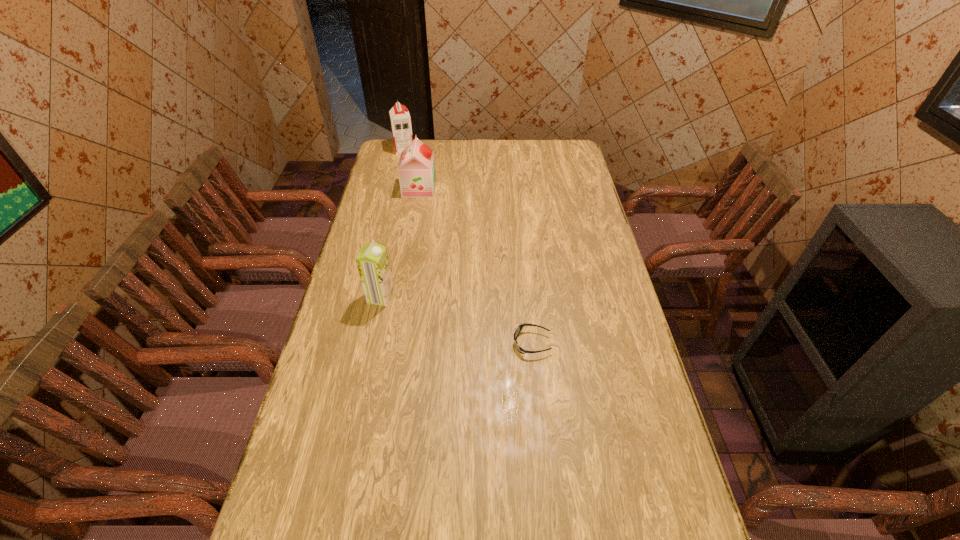
What are the coordinates of `blank space located on the lenses of the sunglasses` in the screenshot? It's located at (383, 343).

What are the coordinates of `object positioned at the far edge` in the screenshot? It's located at click(x=400, y=119).

The image size is (960, 540). I want to click on object situated at the far left corner, so click(400, 119).

I want to click on vacant area at the far edge, so click(x=470, y=160).

Where is `vacant space at the left edge of the desktop`? vacant space at the left edge of the desktop is located at coordinates [272, 522].

At what (x,y) coordinates should I click in order to perform the action: click on vacant space at the right edge of the desktop. Please return your answer as a coordinate pair (x, y). Looking at the image, I should click on (579, 314).

Where is `free point between the third farthest object and the second farthest object`? This screenshot has height=540, width=960. free point between the third farthest object and the second farthest object is located at coordinates (400, 243).

Image resolution: width=960 pixels, height=540 pixels. I want to click on free space between the nearest soya milk and the second farthest object, so click(x=400, y=243).

Where is `vacant space in between the second nearest soya milk and the second nearest object`? vacant space in between the second nearest soya milk and the second nearest object is located at coordinates (400, 243).

The height and width of the screenshot is (540, 960). I want to click on free space between the sunglasses and the farthest object, so click(x=468, y=246).